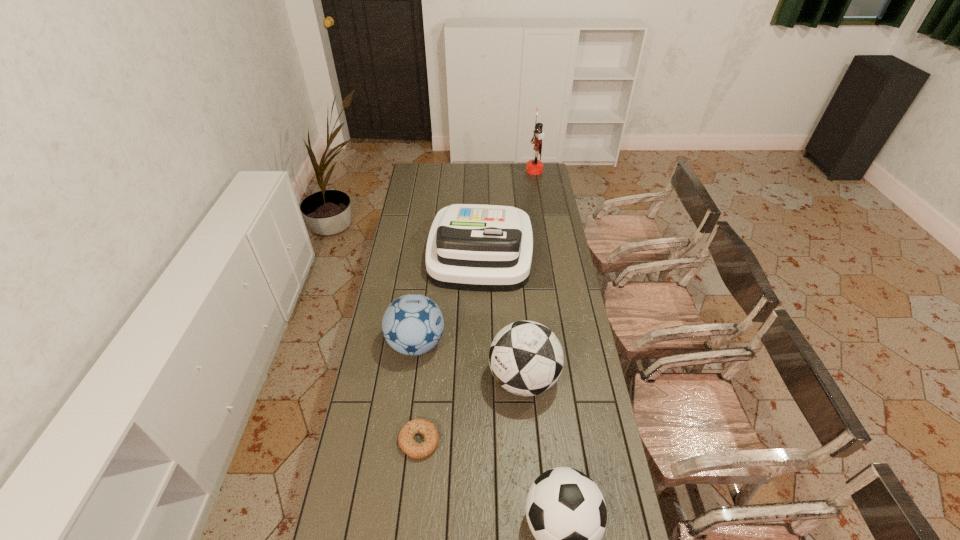
Locate an element on the screen. free space at the right edge is located at coordinates (573, 311).

Image resolution: width=960 pixels, height=540 pixels. In the image, there is a desktop. Identify the location of blank space at the far left corner. (425, 172).

In the image, there is a desktop. Find the location of `vacant space at the far right corner`. vacant space at the far right corner is located at coordinates (536, 177).

Find the location of a particular element. The width and height of the screenshot is (960, 540). free area in between the nutcracker and the shortest object is located at coordinates (477, 306).

Identify the location of object that is the closest one to the nutcracker. (471, 247).

Identify which object is located as the second nearest to the bagel. Please provide its 2D coordinates. Your answer should be formatted as a tuple, i.e. [(x, y)], where the tuple contains the x and y coordinates of a point satisfying the conditions above.

[(413, 324)]

This screenshot has height=540, width=960. In order to click on soccer ball that is the second closest one to the cash register in this screenshot , I will do `click(526, 358)`.

You are a GUI agent. You are given a task and a screenshot of the screen. Output one action in this format:
    pyautogui.click(x=<x>, y=<y>)
    Task: Click on the soccer ball that is the closest to the nearest soccer ball
    
    Given the screenshot: What is the action you would take?
    pyautogui.click(x=526, y=358)

In order to click on free spot that satisfies the following two spatial constraints: 1. on the front-facing side of the farthest object; 2. on the front side of the second nearest object in this screenshot , I will do `click(580, 441)`.

You are a GUI agent. You are given a task and a screenshot of the screen. Output one action in this format:
    pyautogui.click(x=<x>, y=<y>)
    Task: Click on the free point that satisfies the following two spatial constraints: 1. on the side with brand of the bagel; 2. on the left side of the leftmost soccer ball
    
    Given the screenshot: What is the action you would take?
    pyautogui.click(x=404, y=441)